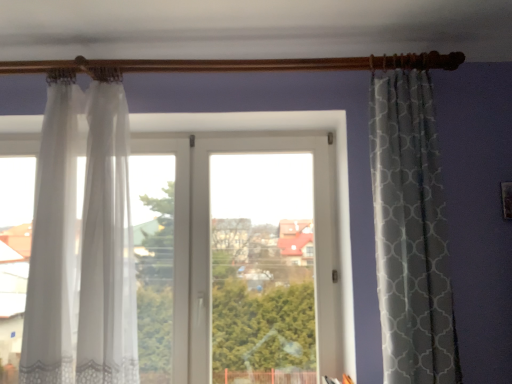
Locate an element on the screen. The height and width of the screenshot is (384, 512). white sheer curtain at left, marked as the second curtain in a left-to-right arrangement is located at coordinates (106, 242).

Image resolution: width=512 pixels, height=384 pixels. What are the coordinates of `sheer white curtain at left, positioned as the 2th curtain in right-to-left order` in the screenshot? It's located at (53, 241).

The height and width of the screenshot is (384, 512). I want to click on white sheer curtain at left, marked as the second curtain in a left-to-right arrangement, so tap(106, 242).

From the image's perspective, which is below, transparent fabric window at center or sheer white curtain at left, positioned as the 2th curtain in right-to-left order?

From the image's view, transparent fabric window at center is below.

In the scene shown: Is transparent fabric window at center aimed at sheer white curtain at left, the 1th curtain positioned from the left?

Yes, transparent fabric window at center is oriented towards sheer white curtain at left, the 1th curtain positioned from the left.

Considering the relative positions of transparent fabric window at center and sheer white curtain at left, positioned as the 2th curtain in right-to-left order, in the image provided, is transparent fabric window at center to the right of sheer white curtain at left, positioned as the 2th curtain in right-to-left order, from the viewer's perspective?

Yes, transparent fabric window at center is to the right of sheer white curtain at left, positioned as the 2th curtain in right-to-left order.

Is transparent fabric window at center facing away from white sheer curtain at left, which is counted as the first curtain, starting from the right?

Yes, white sheer curtain at left, which is counted as the first curtain, starting from the right, is at the back of transparent fabric window at center.

Would you say transparent fabric window at center is to the left or to the right of white sheer curtain at left, which is counted as the first curtain, starting from the right, in the picture?

Clearly, transparent fabric window at center is on the right of white sheer curtain at left, which is counted as the first curtain, starting from the right, in the image.

From the image's perspective, does transparent fabric window at center appear lower than white sheer curtain at left, marked as the second curtain in a left-to-right arrangement?

Yes.

From a real-world perspective, between transparent fabric window at center and white sheer curtain at left, which is counted as the first curtain, starting from the right, who is vertically higher?

From a 3D spatial view, white sheer curtain at left, which is counted as the first curtain, starting from the right, is above.

Visually, is sheer white curtain at left, positioned as the 2th curtain in right-to-left order, positioned to the left or to the right of white sheer curtain at left, marked as the second curtain in a left-to-right arrangement?

sheer white curtain at left, positioned as the 2th curtain in right-to-left order, is positioned on white sheer curtain at left, marked as the second curtain in a left-to-right arrangement,'s left side.

Is sheer white curtain at left, the 1th curtain positioned from the left, wider than white sheer curtain at left, marked as the second curtain in a left-to-right arrangement?

In fact, sheer white curtain at left, the 1th curtain positioned from the left, might be narrower than white sheer curtain at left, marked as the second curtain in a left-to-right arrangement.

Is sheer white curtain at left, the 1th curtain positioned from the left, positioned with its back to white sheer curtain at left, which is counted as the first curtain, starting from the right?

No, sheer white curtain at left, the 1th curtain positioned from the left, is not facing the opposite direction of white sheer curtain at left, which is counted as the first curtain, starting from the right.

Considering the points (58, 325) and (35, 361), which point is behind, point (58, 325) or point (35, 361)?

The point (58, 325) is farther.

Would you say sheer white curtain at left, positioned as the 2th curtain in right-to-left order, contains transparent fabric window at center?

Actually, transparent fabric window at center is outside sheer white curtain at left, positioned as the 2th curtain in right-to-left order.

Between sheer white curtain at left, the 1th curtain positioned from the left, and transparent fabric window at center, which one appears on the left side from the viewer's perspective?

sheer white curtain at left, the 1th curtain positioned from the left, is more to the left.

Considering the sizes of sheer white curtain at left, the 1th curtain positioned from the left, and transparent fabric window at center in the image, is sheer white curtain at left, the 1th curtain positioned from the left, wider or thinner than transparent fabric window at center?

In the image, sheer white curtain at left, the 1th curtain positioned from the left, appears to be wider than transparent fabric window at center.

Does white sheer curtain at left, which is counted as the first curtain, starting from the right, have a lesser height compared to transparent fabric window at center?

Indeed, white sheer curtain at left, which is counted as the first curtain, starting from the right, has a lesser height compared to transparent fabric window at center.

From a real-world perspective, does white sheer curtain at left, marked as the second curtain in a left-to-right arrangement, stand above transparent fabric window at center?

Correct, in the physical world, white sheer curtain at left, marked as the second curtain in a left-to-right arrangement, is higher than transparent fabric window at center.

Can you confirm if white sheer curtain at left, marked as the second curtain in a left-to-right arrangement, is bigger than transparent fabric window at center?

Actually, white sheer curtain at left, marked as the second curtain in a left-to-right arrangement, might be smaller than transparent fabric window at center.

Is point (98, 377) in front of point (337, 288)?

Yes, it is in front of point (337, 288).

Between white sheer curtain at left, marked as the second curtain in a left-to-right arrangement, and sheer white curtain at left, the 1th curtain positioned from the left, which one has less height?

Standing shorter between the two is sheer white curtain at left, the 1th curtain positioned from the left.

From a real-world perspective, is white sheer curtain at left, marked as the second curtain in a left-to-right arrangement, located higher than sheer white curtain at left, positioned as the 2th curtain in right-to-left order?

Actually, white sheer curtain at left, marked as the second curtain in a left-to-right arrangement, is physically below sheer white curtain at left, positioned as the 2th curtain in right-to-left order, in the real world.

Where is `curtain behind the sheer white curtain at left, positioned as the 2th curtain in right-to-left order`? curtain behind the sheer white curtain at left, positioned as the 2th curtain in right-to-left order is located at coordinates (106, 242).

From the picture: Which of these two, white sheer curtain at left, marked as the second curtain in a left-to-right arrangement, or sheer white curtain at left, the 1th curtain positioned from the left, is smaller?

sheer white curtain at left, the 1th curtain positioned from the left, is smaller.

Where is `window beneath the sheer white curtain at left, the 1th curtain positioned from the left (from a real-world perspective)`? The height and width of the screenshot is (384, 512). window beneath the sheer white curtain at left, the 1th curtain positioned from the left (from a real-world perspective) is located at coordinates (209, 238).

Identify the location of window that is behind the white sheer curtain at left, marked as the second curtain in a left-to-right arrangement. (209, 238).

Considering their positions, is sheer white curtain at left, the 1th curtain positioned from the left, positioned closer to white sheer curtain at left, which is counted as the first curtain, starting from the right, than transparent fabric window at center?

sheer white curtain at left, the 1th curtain positioned from the left, is closer to white sheer curtain at left, which is counted as the first curtain, starting from the right.

Looking at the image, which one is located further to sheer white curtain at left, the 1th curtain positioned from the left, white sheer curtain at left, marked as the second curtain in a left-to-right arrangement, or transparent fabric window at center?

transparent fabric window at center is further to sheer white curtain at left, the 1th curtain positioned from the left.

When comparing their distances from transparent fabric window at center, does white sheer curtain at left, marked as the second curtain in a left-to-right arrangement, or sheer white curtain at left, positioned as the 2th curtain in right-to-left order, seem closer?

Among the two, white sheer curtain at left, marked as the second curtain in a left-to-right arrangement, is located nearer to transparent fabric window at center.

When comparing their distances from transparent fabric window at center, does sheer white curtain at left, positioned as the 2th curtain in right-to-left order, or white sheer curtain at left, which is counted as the first curtain, starting from the right, seem closer?

Based on the image, white sheer curtain at left, which is counted as the first curtain, starting from the right, appears to be nearer to transparent fabric window at center.

Estimate the real-world distances between objects in this image. Which object is closer to white sheer curtain at left, marked as the second curtain in a left-to-right arrangement, transparent fabric window at center or sheer white curtain at left, the 1th curtain positioned from the left?

sheer white curtain at left, the 1th curtain positioned from the left, is closer to white sheer curtain at left, marked as the second curtain in a left-to-right arrangement.

Considering their positions, is transparent fabric window at center positioned further to sheer white curtain at left, the 1th curtain positioned from the left, than white sheer curtain at left, marked as the second curtain in a left-to-right arrangement?

Among the two, transparent fabric window at center is located further to sheer white curtain at left, the 1th curtain positioned from the left.

Locate an element on the screen. curtain positioned between sheer white curtain at left, the 1th curtain positioned from the left, and transparent fabric window at center from near to far is located at coordinates (106, 242).